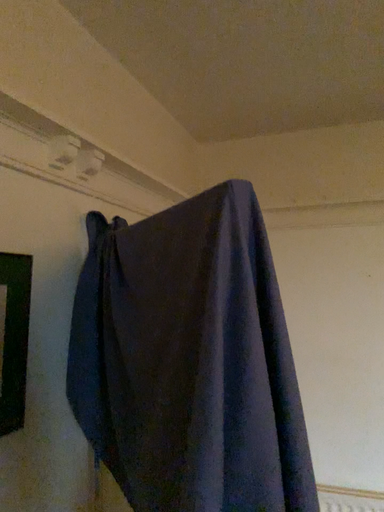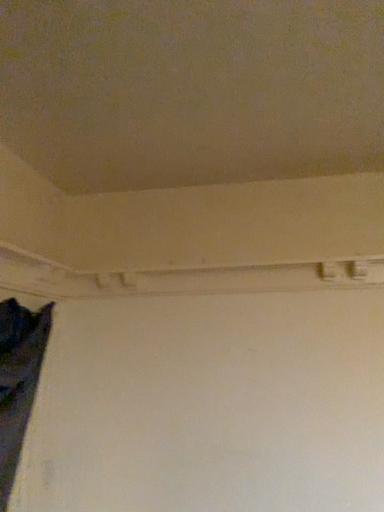
Question: Which way did the camera rotate in the video?

Choices:
 (A) rotated downward
 (B) rotated upward

Answer: (B)